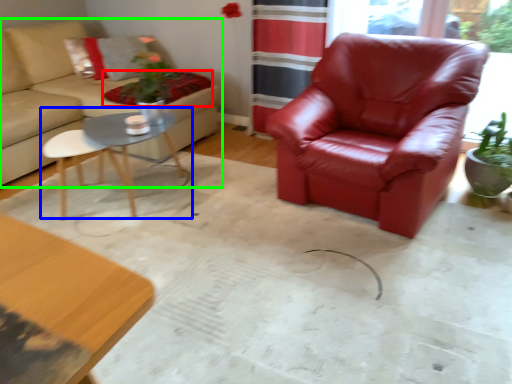
Question: Estimate the real-world distances between objects in this image. Which object is closer to blanket (highlighted by a red box), coffee table (highlighted by a blue box) or studio couch (highlighted by a green box)?

Choices:
 (A) coffee table
 (B) studio couch

Answer: (B)